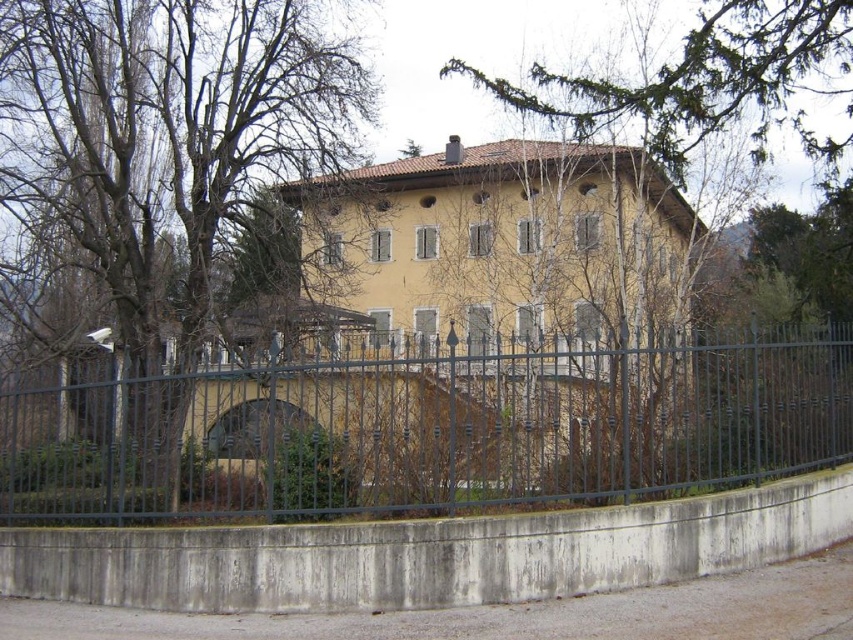
You are a visitor standing in front of the building and want to take a photo that includes both the bare branches at left and the green leafy tree at upper center. Which object will appear larger in the photo?

The bare branches at left will appear larger in the photo because it is much taller than the green leafy tree at upper center.

You are an architect analyzing the building and its surroundings. You notice the bare branches at left and the green leafy tree at upper center. Which of these two objects is bigger in size?

The bare branches at left is larger in size than the green leafy tree at upper center.

Looking at this image, you are standing in front of the two story building and want to know where the metallic dark green fence at center is located. Can you describe its position using coordinates?

The metallic dark green fence at center is located at coordinates point [424,429].